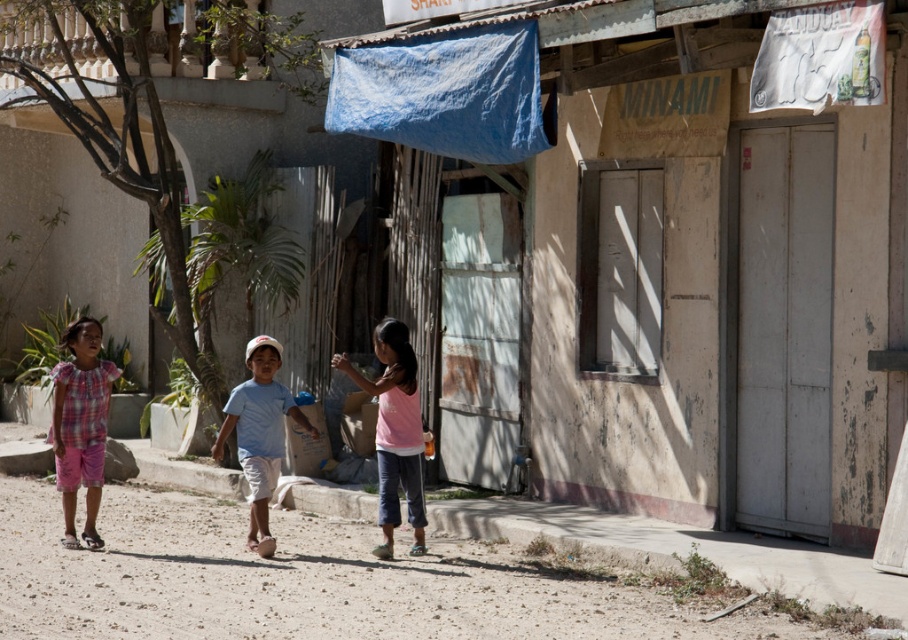
Can you confirm if blue fabric tarp at upper center is taller than pink fabric shirt at center?

In fact, blue fabric tarp at upper center may be shorter than pink fabric shirt at center.

Which is behind, point (427, 122) or point (386, 364)?

Positioned behind is point (427, 122).

At what (x,y) coordinates should I click in order to perform the action: click on blue fabric tarp at upper center. Please return your answer as a coordinate pair (x, y). The width and height of the screenshot is (908, 640). Looking at the image, I should click on (447, 93).

Identify the location of blue fabric tarp at upper center. (447, 93).

Does point (97, 381) come in front of point (262, 378)?

No.

Can you confirm if plaid cotton dress at left is thinner than light blue cotton shirt at center?

Indeed, plaid cotton dress at left has a lesser width compared to light blue cotton shirt at center.

Find the location of a particular element. The height and width of the screenshot is (640, 908). plaid cotton dress at left is located at coordinates (80, 426).

Who is higher up, blue fabric tarp at upper center or plaid cotton dress at left?

blue fabric tarp at upper center is above.

How distant is blue fabric tarp at upper center from plaid cotton dress at left?

blue fabric tarp at upper center and plaid cotton dress at left are 3.00 meters apart from each other.

This screenshot has width=908, height=640. Identify the location of blue fabric tarp at upper center. pyautogui.click(x=447, y=93).